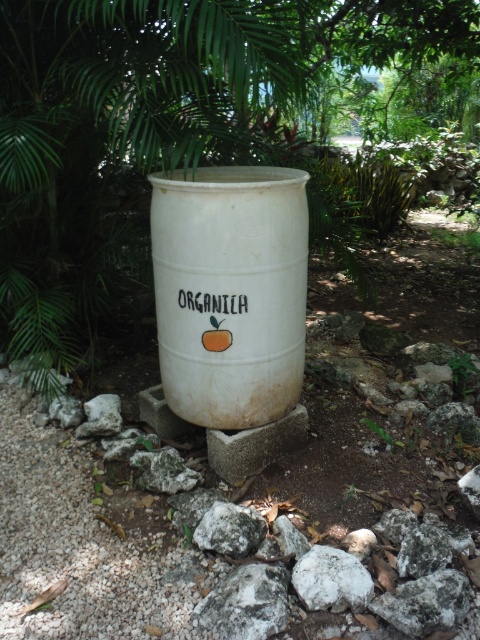
You are standing at the point labeled point (163, 125) in the image. What object is located exactly at this point?

The green leafy tree at upper center is located exactly at point (163, 125).

You are designing a garden layout and need to place a new statue that is 1.2 meters tall. The statue must be placed in front of the green leafy tree at upper center so it can be seen clearly. Considering the size of the white matte barrel at center, will the statue be visible behind the barrel?

The green leafy tree at upper center is bigger than the white matte barrel at center. Since the statue is placed in front of the tree, it will be positioned behind the barrel. However, because the barrel is smaller than the tree, the statue should still be visible behind the barrel as long as the barrel does not directly block the line of sight.

You are a gardener working in the garden. You need to place a new small potted plant between the green leafy tree at upper center and the white rough rock at center. Based on their positions, where should you place the potted plant?

The green leafy tree at upper center is above the white rough rock at center, so you should place the potted plant below the green leafy tree at upper center and above the white rough rock at center to position it between them.